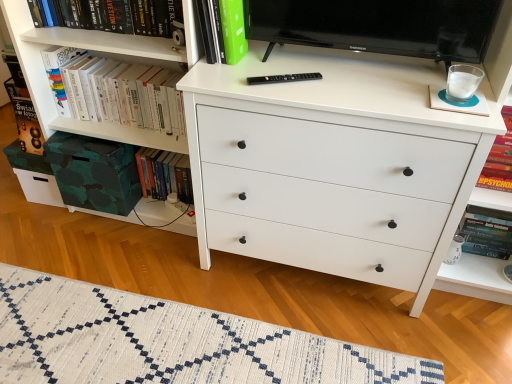
What are the coordinates of `free space between green matte book at upper center, the third book positioned from the left, and black glossy television at upper center` in the screenshot? It's located at (310, 71).